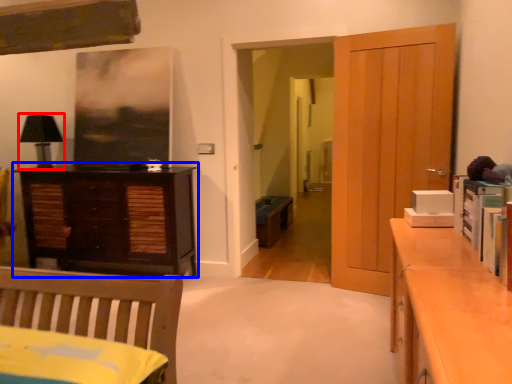
Question: Which object appears farthest to the camera in this image, lamp (highlighted by a red box) or chest of drawers (highlighted by a blue box)?

Choices:
 (A) lamp
 (B) chest of drawers

Answer: (A)